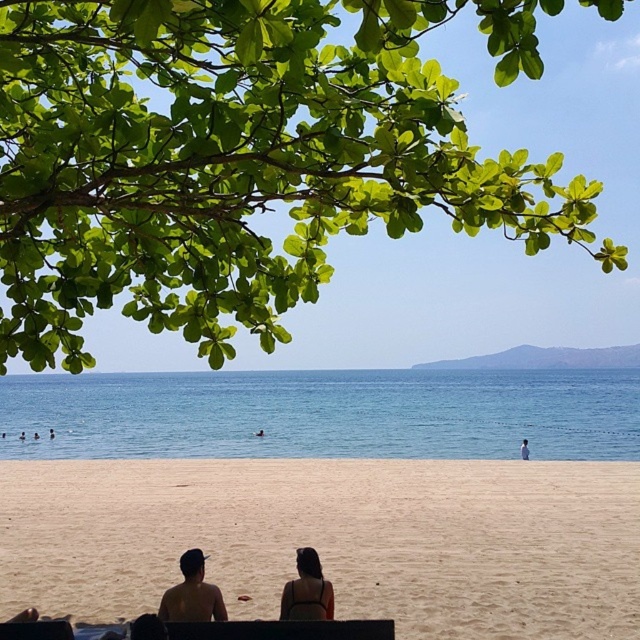
Can you confirm if green leafy branch at upper left is positioned below white cotton shirt at lower center?

No, green leafy branch at upper left is not below white cotton shirt at lower center.

Does green leafy branch at upper left lie in front of white cotton shirt at lower center?

Yes, it is in front of white cotton shirt at lower center.

Between point (70, 371) and point (529, 454), which one is positioned in front?

Point (70, 371)

Locate an element on the screen. The width and height of the screenshot is (640, 640). green leafy branch at upper left is located at coordinates (241, 157).

Based on the photo, which is below, sandy beige at lower center or tan skin couple at center?

sandy beige at lower center is below.

Is sandy beige at lower center above tan skin couple at center?

Actually, sandy beige at lower center is below tan skin couple at center.

Locate an element on the screen. This screenshot has width=640, height=640. sandy beige at lower center is located at coordinates (333, 540).

In the scene shown: Who is lower down, tan skin couple at center or white cotton shirt at lower center?

white cotton shirt at lower center is below.

Does tan skin couple at center have a smaller size compared to white cotton shirt at lower center?

Incorrect, tan skin couple at center is not smaller in size than white cotton shirt at lower center.

Find the location of a particular element. This screenshot has height=640, width=640. tan skin couple at center is located at coordinates (192, 595).